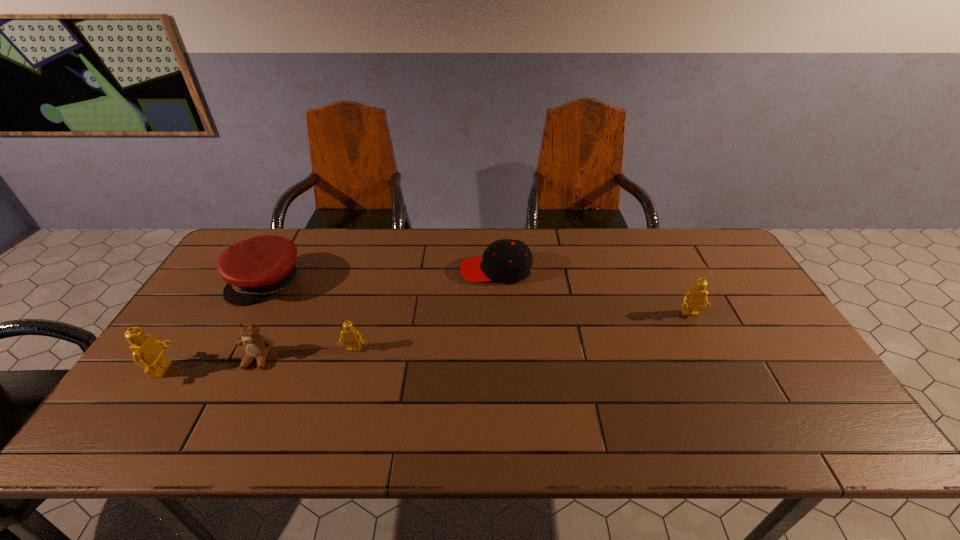
This screenshot has width=960, height=540. I want to click on free space located on the face of the third object from right to left, so click(x=337, y=409).

The height and width of the screenshot is (540, 960). I want to click on vacant position located 0.270m on the face of the farthest Lego, so click(733, 402).

Find the location of a particular element. The image size is (960, 540). vacant region located on the front-facing side of the right cap is located at coordinates (370, 270).

What are the coordinates of `vacant space situated on the front-facing side of the right cap` in the screenshot? It's located at (364, 270).

Where is `vacant region located on the front-facing side of the right cap`? This screenshot has height=540, width=960. vacant region located on the front-facing side of the right cap is located at coordinates (414, 270).

The image size is (960, 540). What are the coordinates of `vacant space situated at the front of the left cap where the visor is located` in the screenshot? It's located at (225, 359).

Identify the location of blank space located on the front-facing side of the teddy bear. Image resolution: width=960 pixels, height=540 pixels. (234, 409).

The width and height of the screenshot is (960, 540). Identify the location of object that is at the near edge. (147, 351).

Image resolution: width=960 pixels, height=540 pixels. In order to click on Lego situated at the left edge in this screenshot , I will do `click(147, 351)`.

Where is `cap present at the left edge`? The image size is (960, 540). cap present at the left edge is located at coordinates (255, 268).